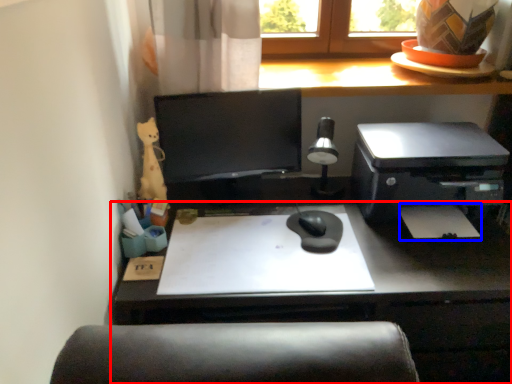
Question: Which point is closer to the camera, desk (highlighted by a red box) or notepad (highlighted by a blue box)?

Choices:
 (A) desk
 (B) notepad

Answer: (A)